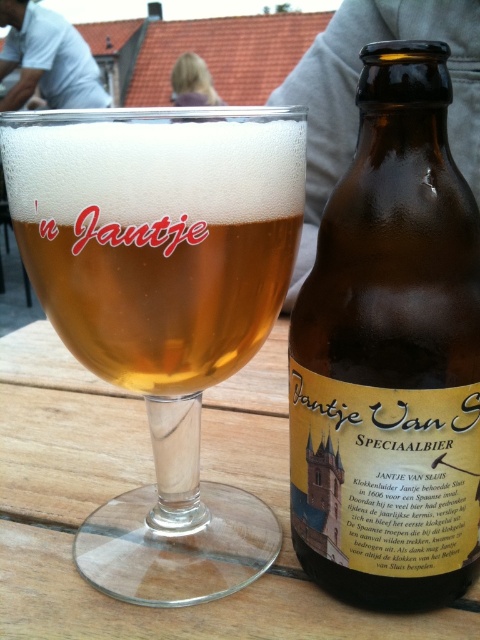
Question: Which point appears closest to the camera in this image?

Choices:
 (A) (80, 170)
 (B) (297, 508)

Answer: (A)

Question: Among these points, which one is farthest from the camera?

Choices:
 (A) (264, 284)
 (B) (465, 426)

Answer: (A)

Question: Can you confirm if clear glass beer glass at center is wider than brown glass bottle at center?

Choices:
 (A) yes
 (B) no

Answer: (A)

Question: Is clear glass beer glass at center bigger than brown glass bottle at center?

Choices:
 (A) no
 (B) yes

Answer: (B)

Question: Can you confirm if clear glass beer glass at center is positioned to the left of brown glass bottle at center?

Choices:
 (A) yes
 (B) no

Answer: (A)